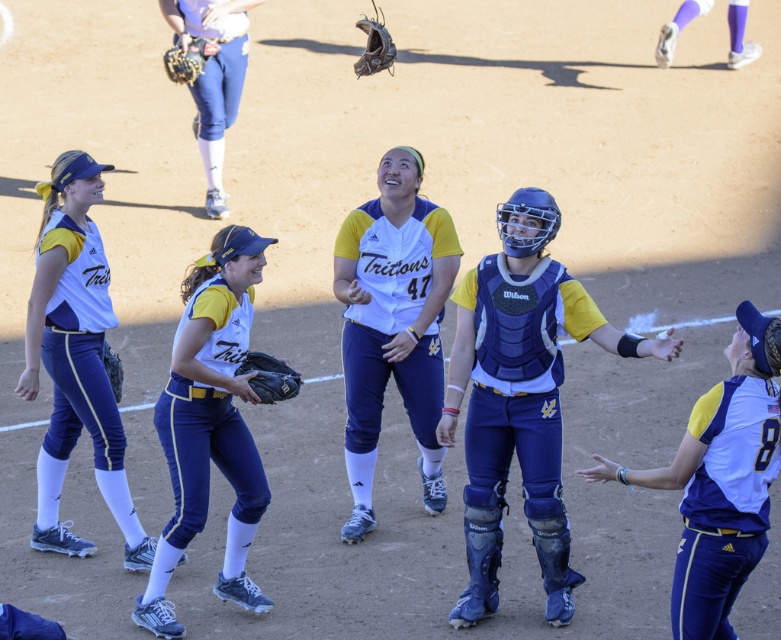
Which is behind, point (384, 64) or point (191, 42)?

The point (384, 64) is behind.

Is point (380, 20) positioned in front of point (191, 52)?

No, (380, 20) is further to viewer.

Where is `brown leather glove at upper center`? The image size is (781, 640). brown leather glove at upper center is located at coordinates pyautogui.click(x=375, y=45).

Can you confirm if white matte uniform at left is thinner than brown leather glove at upper left?

No, white matte uniform at left is not thinner than brown leather glove at upper left.

Is white matte uniform at left smaller than brown leather glove at upper left?

Incorrect, white matte uniform at left is not smaller in size than brown leather glove at upper left.

Locate an element on the screen. white matte uniform at left is located at coordinates (75, 358).

Does white matte jersey at lower right appear over brown leather glove at upper center?

Actually, white matte jersey at lower right is below brown leather glove at upper center.

Does white matte jersey at lower right have a lesser height compared to brown leather glove at upper center?

No, white matte jersey at lower right is not shorter than brown leather glove at upper center.

Where is `white matte jersey at lower right`? Image resolution: width=781 pixels, height=640 pixels. white matte jersey at lower right is located at coordinates (724, 502).